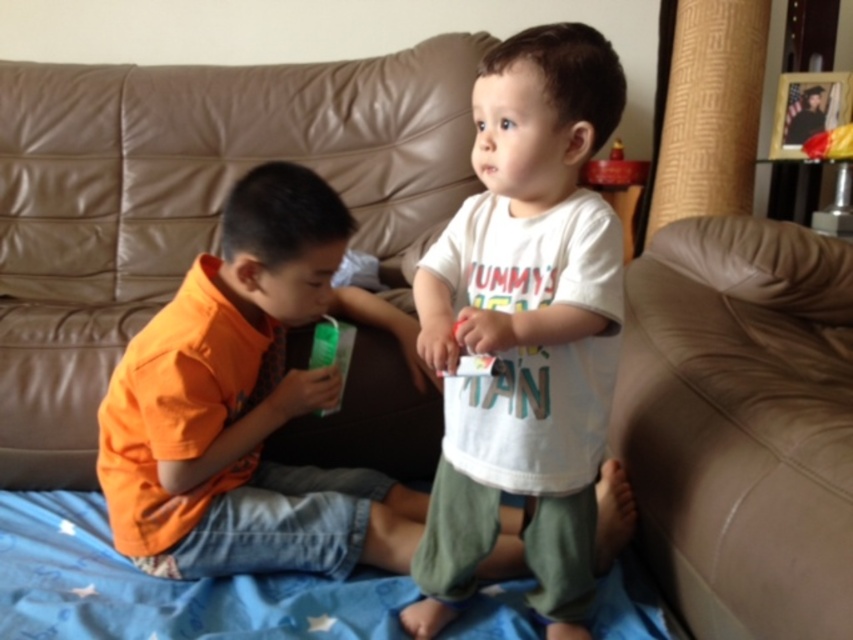
Can you confirm if brown leather couch at center is positioned to the right of leather couch at lower right?

In fact, brown leather couch at center is to the left of leather couch at lower right.

Is brown leather couch at center positioned before leather couch at lower right?

No, it is behind leather couch at lower right.

Between point (381, 166) and point (792, 227), which one is positioned in front?

Point (792, 227) is more forward.

Find the location of a particular element. This screenshot has height=640, width=853. brown leather couch at center is located at coordinates [186, 204].

Does leather couch at lower right lie in front of green plastic bottle at center?

Yes, it is.

Between leather couch at lower right and green plastic bottle at center, which one appears on the left side from the viewer's perspective?

green plastic bottle at center is more to the left.

Where is `leather couch at lower right`? leather couch at lower right is located at coordinates (741, 422).

Does white cotton shirt at center appear under green plastic bottle at center?

Yes, white cotton shirt at center is below green plastic bottle at center.

Between white cotton shirt at center and green plastic bottle at center, which one appears on the left side from the viewer's perspective?

green plastic bottle at center is more to the left.

Image resolution: width=853 pixels, height=640 pixels. Find the location of `white cotton shirt at center`. white cotton shirt at center is located at coordinates (525, 326).